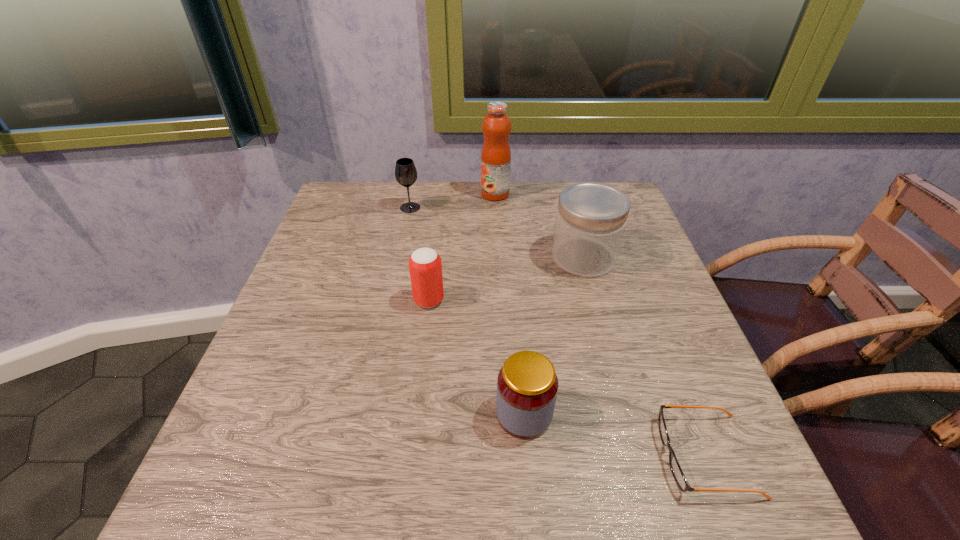
You are a GUI agent. You are given a task and a screenshot of the screen. Output one action in this format:
    pyautogui.click(x=<x>, y=<y>)
    Task: Click on the blank space at the right edge of the desktop
    The image size is (960, 540).
    Given the screenshot: What is the action you would take?
    pyautogui.click(x=636, y=365)

Image resolution: width=960 pixels, height=540 pixels. In the image, there is a desktop. Find the location of `vacant space at the near right corner`. vacant space at the near right corner is located at coordinates (685, 521).

Find the location of a particular element. empty space that is in between the taller jar and the wineglass is located at coordinates (496, 232).

The width and height of the screenshot is (960, 540). Identify the location of free space between the farther jar and the fruit juice. (540, 226).

The width and height of the screenshot is (960, 540). I want to click on vacant area that lies between the shorter jar and the tallest object, so click(510, 304).

You are a GUI agent. You are given a task and a screenshot of the screen. Output one action in this format:
    pyautogui.click(x=<x>, y=<y>)
    Task: Click on the vacant space in between the right jar and the second object from left to right
    
    Given the screenshot: What is the action you would take?
    pyautogui.click(x=506, y=279)

You are a GUI agent. You are given a task and a screenshot of the screen. Output one action in this format:
    pyautogui.click(x=<x>, y=<y>)
    Task: Click on the vacant space in between the spectacles and the tallest object
    The width and height of the screenshot is (960, 540).
    Given the screenshot: What is the action you would take?
    pyautogui.click(x=601, y=325)

Find the location of `vacant space that is in between the nearer jar and the beer can`. vacant space that is in between the nearer jar and the beer can is located at coordinates (476, 357).

Identify the location of free spot between the spectacles and the shorter jar. The height and width of the screenshot is (540, 960). (615, 435).

The width and height of the screenshot is (960, 540). I want to click on vacant point located between the leftmost object and the farthest object, so click(x=452, y=201).